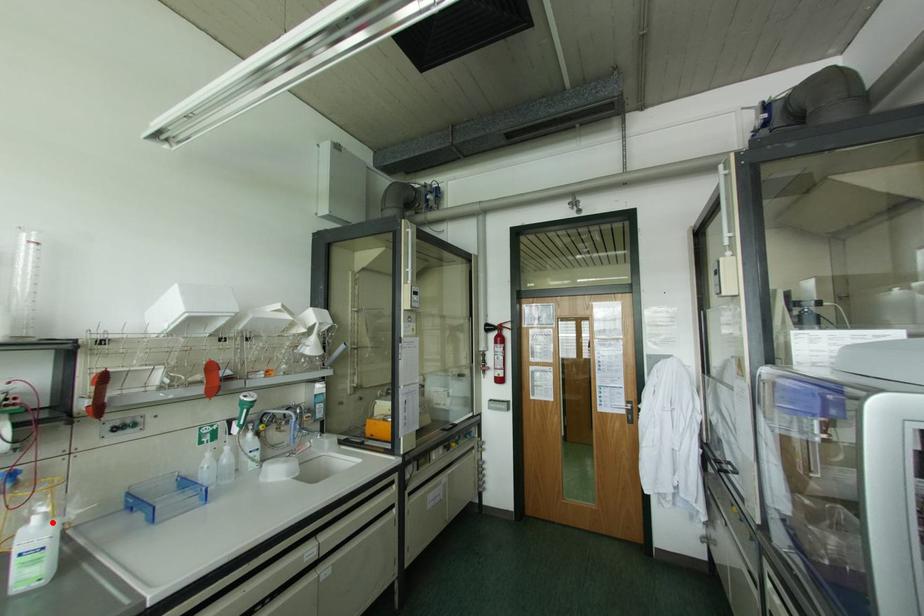
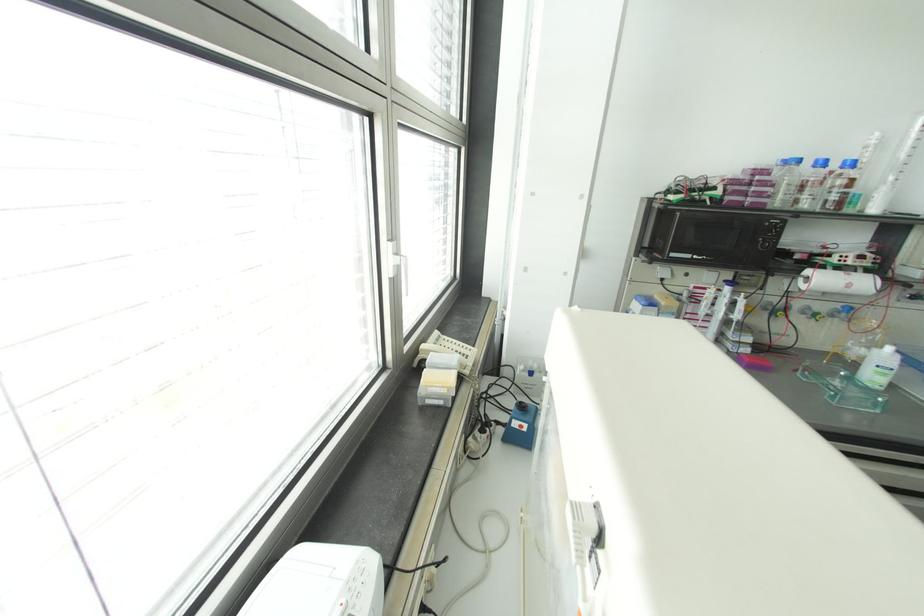
Locate, in the second image, the point that corresponds to the highlighted location in the first image.

(898, 355)